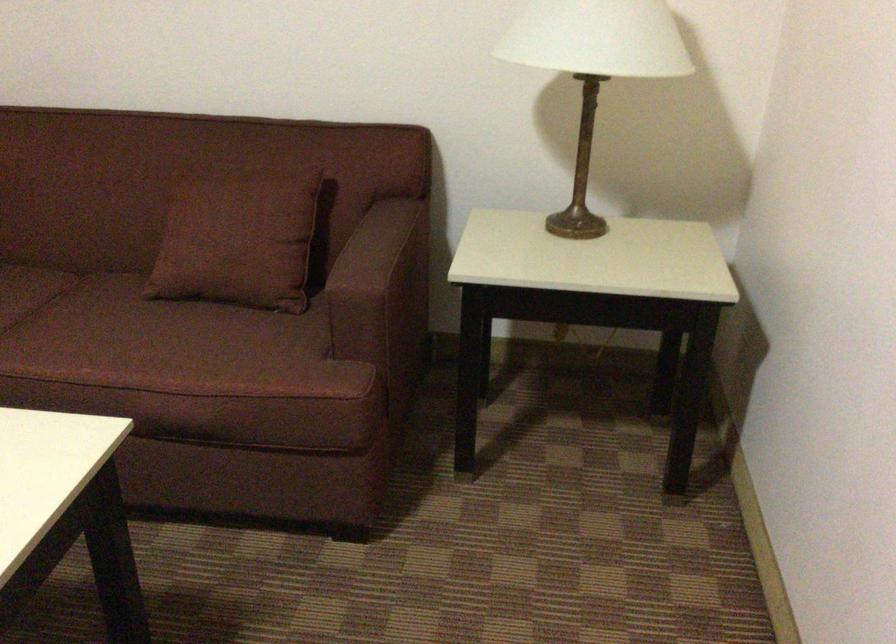
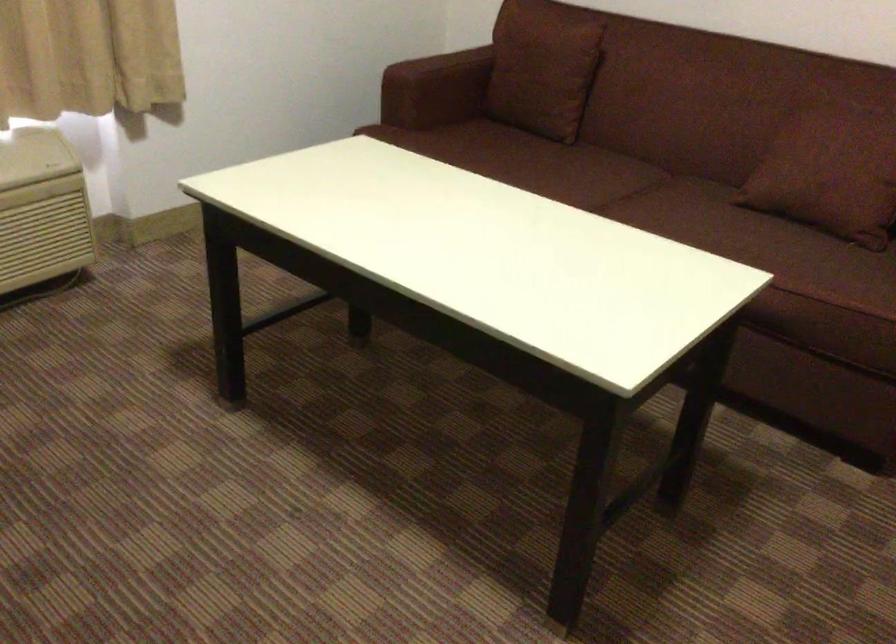
Question: The camera is either moving clockwise (left) or counter-clockwise (right) around the object. The first image is from the beginning of the video and the second image is from the end. Is the camera moving left or right when shooting the video?

Choices:
 (A) Left
 (B) Right

Answer: (B)